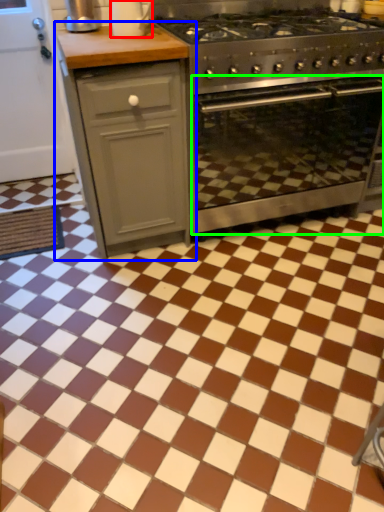
Question: Estimate the real-world distances between objects in this image. Which object is farther from kitchen appliance (highlighted by a red box), cabinetry (highlighted by a blue box) or oven (highlighted by a green box)?

Choices:
 (A) cabinetry
 (B) oven

Answer: (B)